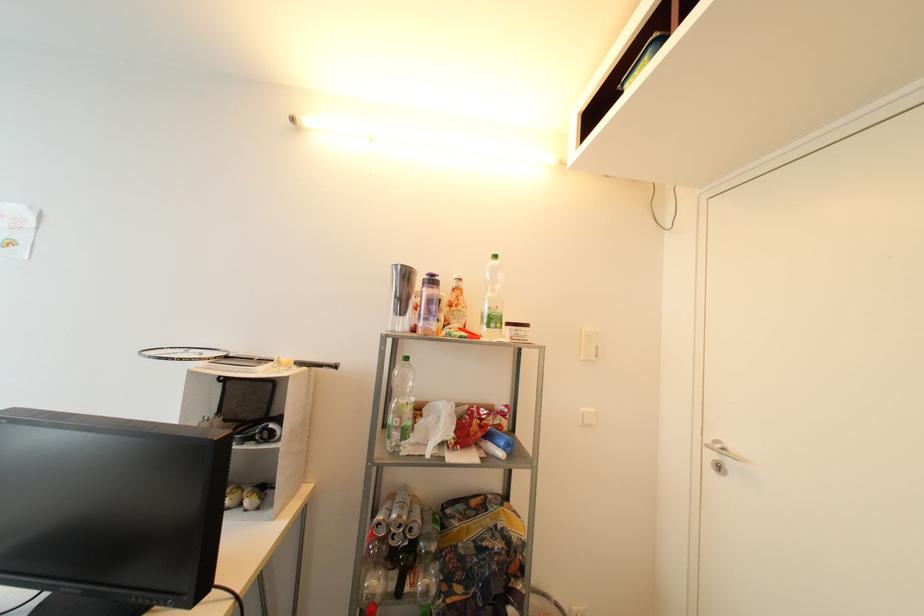
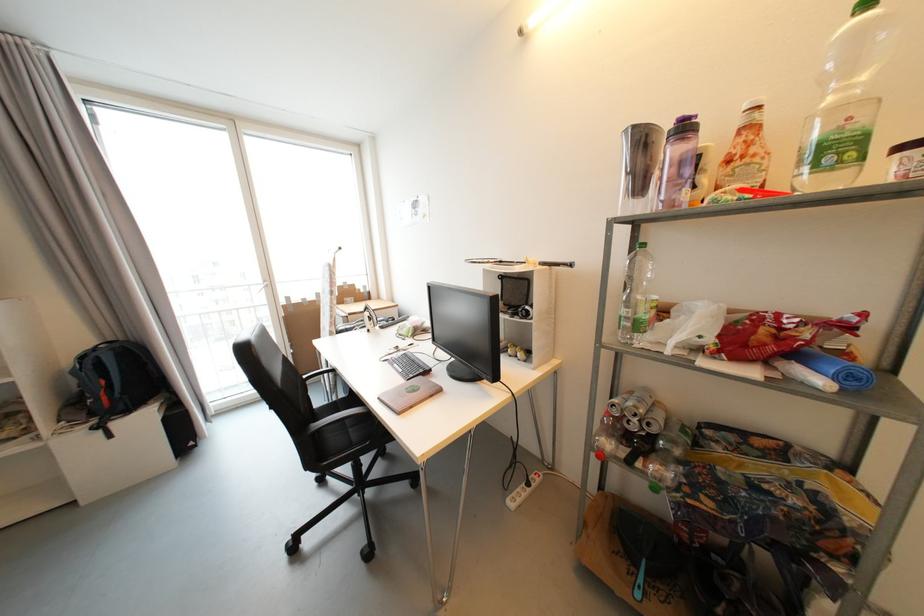
In the second image, find the point that corresponds to (x=400, y=430) in the first image.

(631, 320)